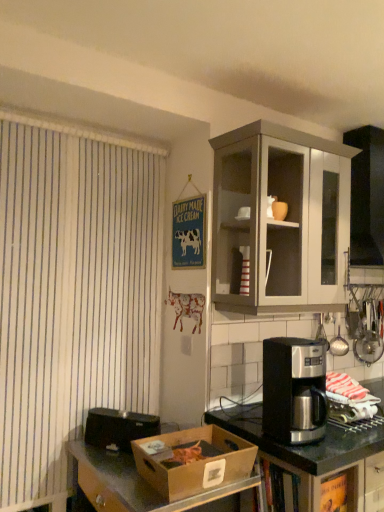
Locate an element on the screen. The height and width of the screenshot is (512, 384). black plastic toaster at lower left, the first appliance in the front-to-back sequence is located at coordinates (118, 428).

This screenshot has height=512, width=384. What do you see at coordinates (279, 210) in the screenshot? I see `matte ceramic cup at upper center` at bounding box center [279, 210].

Measure the distance between point (328, 422) and camera.

They are 1.64 meters apart.

Locate an element on the screen. stainless steel coffee maker at right is located at coordinates (319, 461).

Locate an element on the screen. Image resolution: width=384 pixels, height=512 pixels. black plastic toaster at lower left, which is the first appliance in left-to-right order is located at coordinates (118, 428).

Is the surface of matte gray cabinet at upper right in direct contact with black plastic toaster at lower left, the first appliance in the front-to-back sequence?

No, matte gray cabinet at upper right is not touching black plastic toaster at lower left, the first appliance in the front-to-back sequence.

Is matte gray cabinet at upper right at the right side of black plastic toaster at lower left, which is the second appliance in right-to-left order?

Yes.

Measure the distance from matte gray cabinet at upper right to black plastic toaster at lower left, which is the second appliance in back-to-front order.

matte gray cabinet at upper right and black plastic toaster at lower left, which is the second appliance in back-to-front order, are 1.01 meters apart from each other.

How different are the orientations of matte gray cabinet at upper right and black plastic toaster at lower left, which is the second appliance in right-to-left order, in degrees?

They differ by 53.1 degrees in their facing directions.

Looking at their sizes, would you say stainless steel coffee maker at right is wider or thinner than metallic silver cooking utensils at right, which is the 1th appliance in right-to-left order?

stainless steel coffee maker at right is wider than metallic silver cooking utensils at right, which is the 1th appliance in right-to-left order.

You are a GUI agent. You are given a task and a screenshot of the screen. Output one action in this format:
    pyautogui.click(x=<x>, y=<y>)
    Task: Click on the appliance on the right side of stainless steel coffee maker at right
    
    Given the screenshot: What is the action you would take?
    pyautogui.click(x=369, y=337)

Does stainless steel coffee maker at right appear on the right side of metallic silver cooking utensils at right, which is the 1th appliance in right-to-left order?

In fact, stainless steel coffee maker at right is to the left of metallic silver cooking utensils at right, which is the 1th appliance in right-to-left order.

Are stainless steel coffee maker at right and metallic silver cooking utensils at right, arranged as the second appliance when viewed from the front, making contact?

No, stainless steel coffee maker at right is not beside metallic silver cooking utensils at right, arranged as the second appliance when viewed from the front.

From a real-world perspective, which is physically below, matte ceramic cup at upper center or white striped curtain at left?

From a 3D spatial view, white striped curtain at left is below.

Considering the sizes of objects matte ceramic cup at upper center and white striped curtain at left in the image provided, who is wider, matte ceramic cup at upper center or white striped curtain at left?

white striped curtain at left is wider.

Between point (287, 206) and point (58, 160), which one is positioned in front?

The point (58, 160) is closer.

From the image's perspective, is matte gray cabinet at upper right located above white striped curtain at left?

Yes, from the image's perspective, matte gray cabinet at upper right is on top of white striped curtain at left.

Is the depth of matte gray cabinet at upper right less than that of white striped curtain at left?

Yes, it is in front of white striped curtain at left.

From a real-world perspective, is matte gray cabinet at upper right located higher than white striped curtain at left?

Indeed, from a real-world perspective, matte gray cabinet at upper right stands above white striped curtain at left.

Which is more to the left, matte gray cabinet at upper right or white striped curtain at left?

white striped curtain at left is more to the left.

Is white striped curtain at left bigger or smaller than brown cardboard box at lower left?

In the image, white striped curtain at left appears to be larger than brown cardboard box at lower left.

Is white striped curtain at left not near brown cardboard box at lower left?

white striped curtain at left is near brown cardboard box at lower left, not far away.

From the picture: Measure the distance between white striped curtain at left and brown cardboard box at lower left.

A distance of 24.73 inches exists between white striped curtain at left and brown cardboard box at lower left.

Considering the relative positions of white striped curtain at left and brown cardboard box at lower left in the image provided, is white striped curtain at left to the left or to the right of brown cardboard box at lower left?

From the image, it's evident that white striped curtain at left is to the left of brown cardboard box at lower left.

Can you confirm if black plastic toaster at lower left, which appears as the first appliance when ordered from the bottom, is bigger than metallic silver cooking utensils at right, which is counted as the second appliance, starting from the left?

No, black plastic toaster at lower left, which appears as the first appliance when ordered from the bottom, is not bigger than metallic silver cooking utensils at right, which is counted as the second appliance, starting from the left.

Which of these two, black plastic toaster at lower left, which is the second appliance in back-to-front order, or metallic silver cooking utensils at right, the first appliance positioned from the back, is thinner?

Thinner between the two is metallic silver cooking utensils at right, the first appliance positioned from the back.

In the image, is black plastic toaster at lower left, which is the second appliance in back-to-front order, positioned in front of or behind metallic silver cooking utensils at right, which is the 1th appliance in right-to-left order?

black plastic toaster at lower left, which is the second appliance in back-to-front order, is in front of metallic silver cooking utensils at right, which is the 1th appliance in right-to-left order.

From a real-world perspective, does white striped curtain at left sit lower than matte ceramic cup at upper center?

Correct, in the physical world, white striped curtain at left is lower than matte ceramic cup at upper center.

From the image's perspective, is white striped curtain at left above matte ceramic cup at upper center?

No, from the image's perspective, white striped curtain at left is not above matte ceramic cup at upper center.

Considering the relative sizes of white striped curtain at left and matte ceramic cup at upper center in the image provided, is white striped curtain at left wider than matte ceramic cup at upper center?

Yes, white striped curtain at left is wider than matte ceramic cup at upper center.

Does white striped curtain at left touch matte ceramic cup at upper center?

white striped curtain at left and matte ceramic cup at upper center are clearly separated.

Locate an element on the screen. The image size is (384, 512). cabinetry that is in front of the black plastic toaster at lower left, which is the second appliance in back-to-front order is located at coordinates (281, 221).

The height and width of the screenshot is (512, 384). I want to click on counter below the metallic silver cooking utensils at right, acting as the 2th appliance starting from the bottom (from the image's perspective), so click(x=319, y=461).

From the picture: From the image, which object appears to be farther from matte ceramic cup at upper center, brown cardboard box at lower left or black plastic toaster at lower left, which appears as the first appliance when ordered from the bottom?

brown cardboard box at lower left.

Considering their positions, is metallic silver coffee maker at right positioned closer to white striped curtain at left than metallic silver cooking utensils at right, the 1th appliance in the top-to-bottom sequence?

Based on the image, metallic silver coffee maker at right appears to be nearer to white striped curtain at left.

Which object lies further to the anchor point metallic silver cooking utensils at right, the 1th appliance in the top-to-bottom sequence, brown cardboard box at lower left or matte gray cabinet at upper right?

brown cardboard box at lower left.

Based on the photo, looking at the image, which one is located further to matte gray cabinet at upper right, metallic silver coffee maker at right or brown cardboard box at lower left?

brown cardboard box at lower left lies further to matte gray cabinet at upper right than the other object.

When comparing their distances from black plastic toaster at lower left, which appears as the first appliance when ordered from the bottom, does brown cardboard box at lower left or matte gray cabinet at upper right seem closer?

Based on the image, brown cardboard box at lower left appears to be nearer to black plastic toaster at lower left, which appears as the first appliance when ordered from the bottom.

From the image, which object appears to be farther from matte gray cabinet at upper right, matte ceramic cup at upper center or stainless steel coffee maker at right?

stainless steel coffee maker at right.

When comparing their distances from metallic silver cooking utensils at right, acting as the 2th appliance starting from the bottom, does matte gray cabinet at upper right or white striped curtain at left seem closer?

Based on the image, matte gray cabinet at upper right appears to be nearer to metallic silver cooking utensils at right, acting as the 2th appliance starting from the bottom.

Which object lies nearer to the anchor point brown cardboard box at lower left, metallic silver coffee maker at right or metallic silver cooking utensils at right, which is counted as the second appliance, starting from the left?

metallic silver coffee maker at right is positioned closer to the anchor brown cardboard box at lower left.

Find the location of a particular element. The image size is (384, 512). counter between white striped curtain at left and metallic silver cooking utensils at right, the 1th appliance in the top-to-bottom sequence is located at coordinates (319, 461).

What are the coordinates of `curtain between matte ceramic cup at upper center and brown cardboard box at lower left in the vertical direction` in the screenshot? It's located at (73, 293).

This screenshot has width=384, height=512. I want to click on appliance situated between white striped curtain at left and metallic silver cooking utensils at right, which is counted as the second appliance, starting from the left, from left to right, so click(x=118, y=428).

Locate an element on the screen. Image resolution: width=384 pixels, height=512 pixels. coffee maker between black plastic toaster at lower left, which is the first appliance in left-to-right order, and stainless steel coffee maker at right is located at coordinates (294, 390).